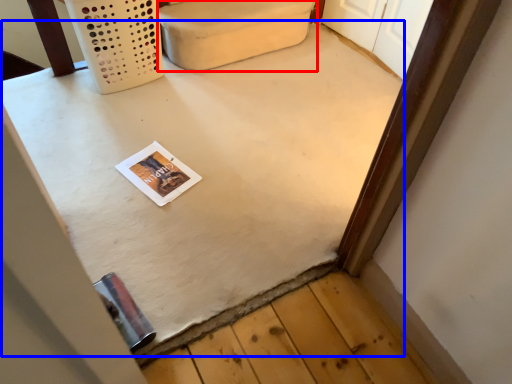
Question: Which object appears closest to the camera in this image, furniture (highlighted by a red box) or table (highlighted by a blue box)?

Choices:
 (A) furniture
 (B) table

Answer: (B)